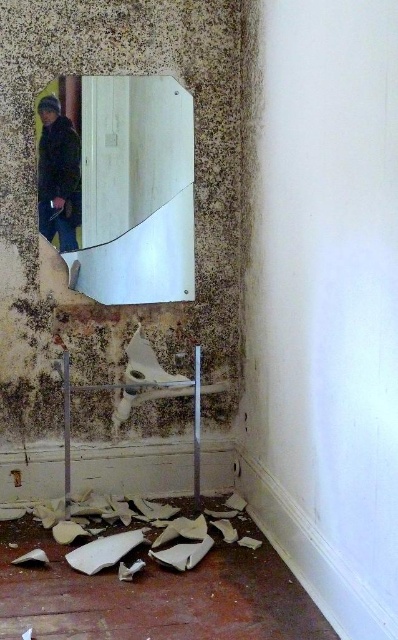
Looking at this image, who is positioned more to the left, white matte debris at lower center or dark blue jacket at left?

dark blue jacket at left

Who is shorter, white matte debris at lower center or dark blue jacket at left?

With less height is white matte debris at lower center.

Locate an element on the screen. Image resolution: width=398 pixels, height=640 pixels. white matte debris at lower center is located at coordinates (126, 531).